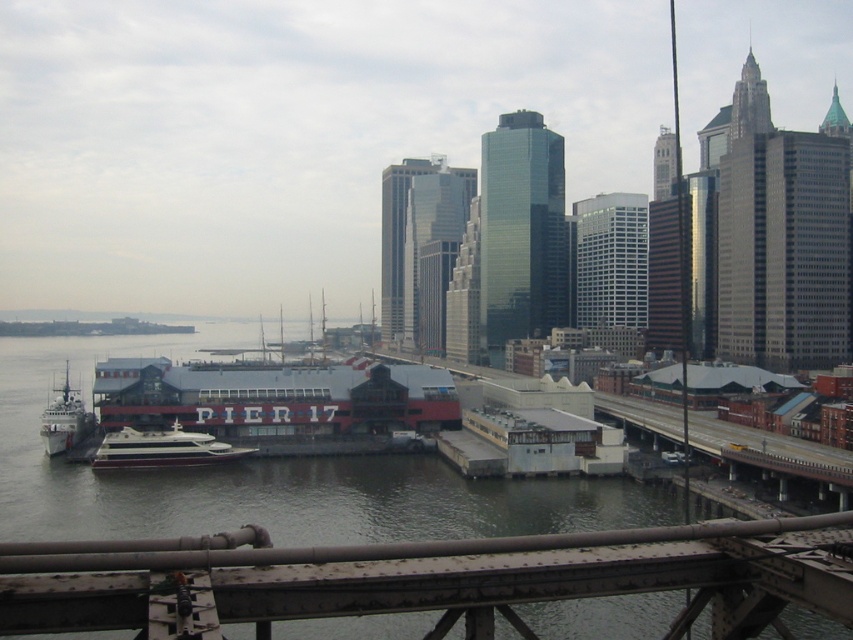
You are a tour guide explaining the waterfront to visitors. Pointing to the shiny white yacht at center and the metallic gray ship at lower left, you want to describe their relative positions. Which vessel is located to the right of the other?

The shiny white yacht at center is positioned on the right side of the metallic gray ship at lower left.